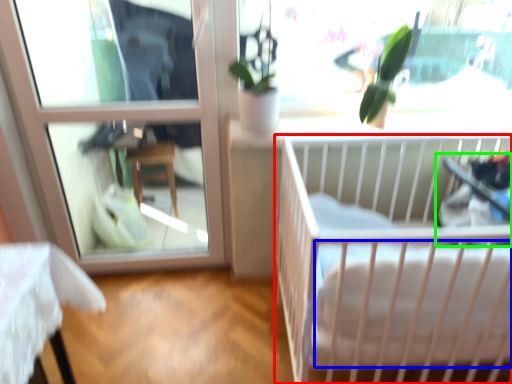
Question: Which object is positioned closest to infant bed (highlighted by a red box)? Select from mattress (highlighted by a blue box) and baby carriage (highlighted by a green box).

Choices:
 (A) mattress
 (B) baby carriage

Answer: (A)